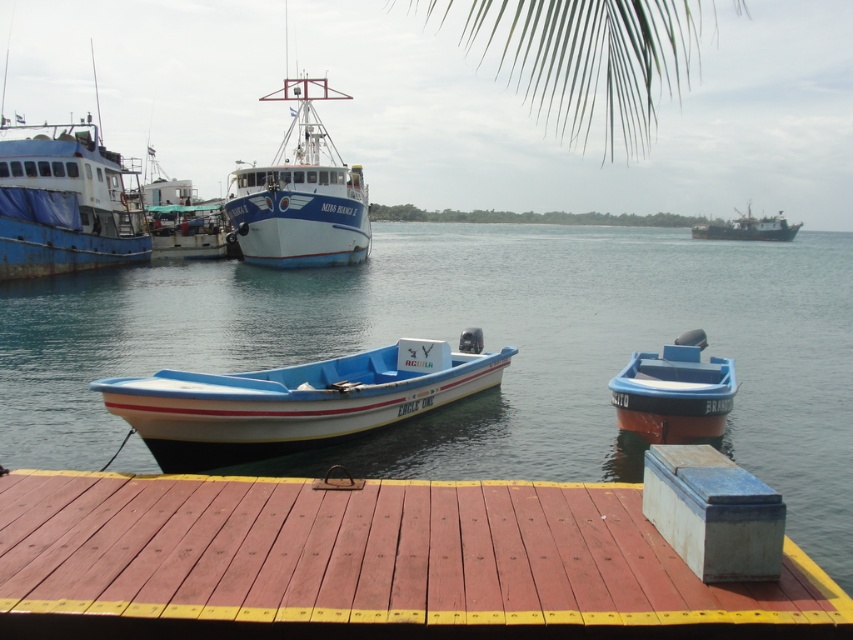
You are a dock attendant who needs to move the blue painted metal boat at left and the blue plastic boat at right to a new dock. The new dock can only hold boats that are smaller than 10 meters in length. Based on the information provided, which boat can be moved to the new dock?

The blue plastic boat at right can be moved to the new dock because it is smaller in size compared to the blue painted metal boat at left, which may exceed the 10 meters length limit.

You are a dock worker who needs to load cargo onto both the white plastic boat at center and the white matte ship at upper right. Which vessel can accommodate taller cargo without clearance issues?

The white matte ship at upper right can accommodate taller cargo because it is taller than the white plastic boat at center.

You are standing on the wooden dock with a reddish brown surface and yellow border. You see the white plastic boat at center and the white matte ship at upper right. Which one is positioned more to the left side of the scene?

The white plastic boat at center is positioned more to the left side of the scene than the white matte ship at upper right.